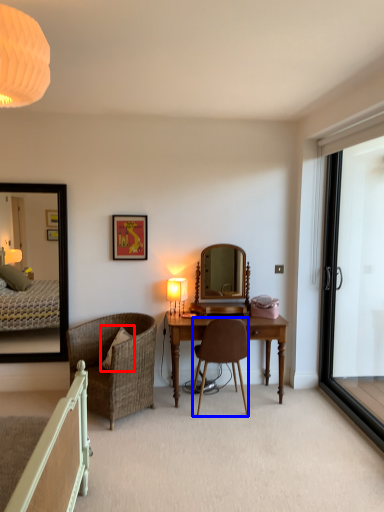
Question: Which object is further to the camera taking this photo, pillow (highlighted by a red box) or chair (highlighted by a blue box)?

Choices:
 (A) pillow
 (B) chair

Answer: (A)